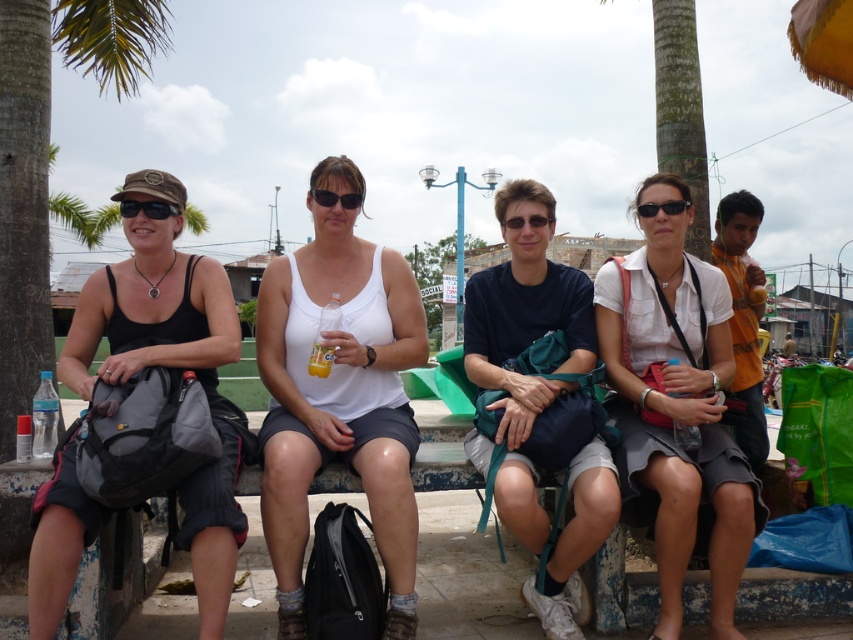
Question: Among these points, which one is nearest to the camera?

Choices:
 (A) (167, 204)
 (B) (346, 202)
 (C) (544, 221)
 (D) (410, 426)

Answer: (A)

Question: Does matte black sunglasses at left have a smaller size compared to matte white sunglasses at center?

Choices:
 (A) yes
 (B) no

Answer: (B)

Question: Which of the following is the farthest from the observer?

Choices:
 (A) matte black sunglasses at left
 (B) white matte tank top at center
 (C) matte black backpack at left
 (D) black matte sunglasses at center

Answer: (D)

Question: Does white matte tank top at center have a greater width compared to matte black sunglasses at left?

Choices:
 (A) yes
 (B) no

Answer: (A)

Question: Which object is the closest to the matte black sunglasses at left?

Choices:
 (A) matte white sunglasses at center
 (B) white matte shirt at center
 (C) black matte sunglasses at center
 (D) matte black backpack at left

Answer: (D)

Question: Can you confirm if white matte shirt at center is positioned below black matte sunglasses at center?

Choices:
 (A) no
 (B) yes

Answer: (B)